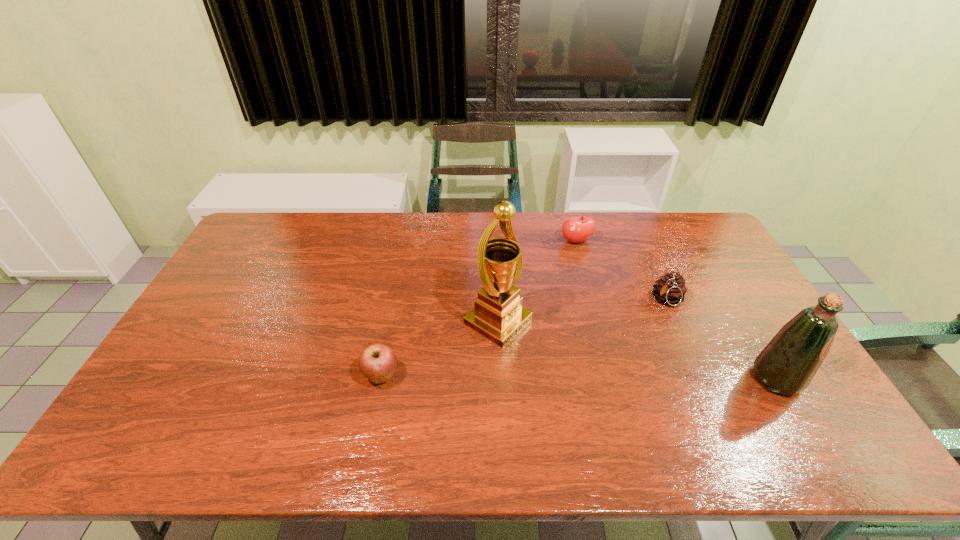
Identify the location of vacant region between the rightmost object and the second object from left to right. Image resolution: width=960 pixels, height=540 pixels. (637, 350).

Locate an element on the screen. The image size is (960, 540). blank region between the rightmost object and the left apple is located at coordinates (579, 377).

Image resolution: width=960 pixels, height=540 pixels. What are the coordinates of `unoccupied position between the olive oil and the pinecone` in the screenshot? It's located at (722, 340).

The height and width of the screenshot is (540, 960). I want to click on vacant point located between the farthest object and the pinecone, so click(622, 271).

Locate an element on the screen. Image resolution: width=960 pixels, height=540 pixels. vacant space that's between the farthest object and the pinecone is located at coordinates (622, 271).

Locate an element on the screen. free spot between the pinecone and the tallest object is located at coordinates (583, 311).

This screenshot has height=540, width=960. Identify the location of vacant space in between the second object from right to left and the left apple. 524,338.

Image resolution: width=960 pixels, height=540 pixels. In order to click on free space between the second object from left to right and the farthest object in this screenshot , I will do `click(537, 282)`.

The image size is (960, 540). What are the coordinates of `vacant area between the olive oil and the leftmost object` in the screenshot? It's located at (579, 377).

Point out which object is positioned as the fourth nearest to the left apple. Please provide its 2D coordinates. Your answer should be formatted as a tuple, i.e. [(x, y)], where the tuple contains the x and y coordinates of a point satisfying the conditions above.

[(787, 365)]